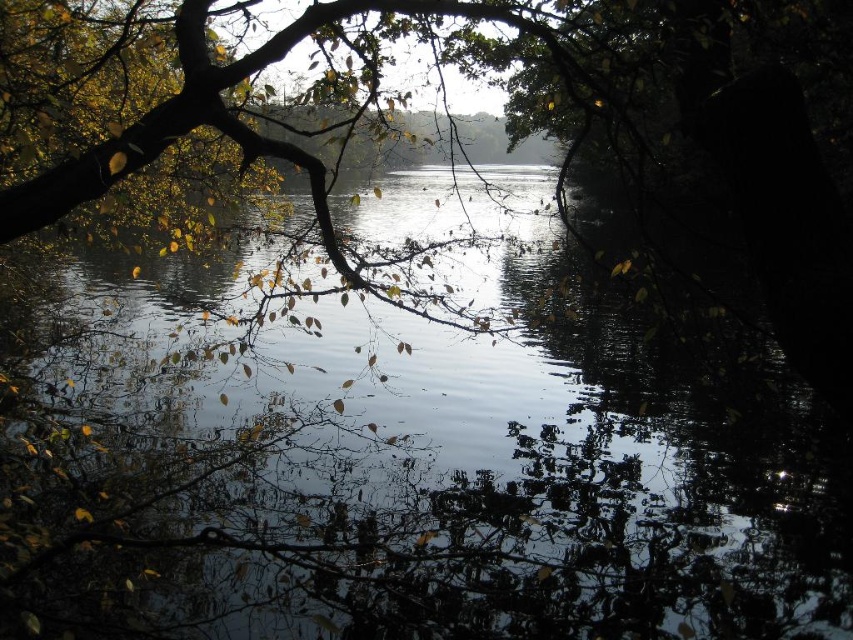
Question: In this image, where is transparent water at center located relative to green matte leaves at upper left?

Choices:
 (A) left
 (B) right

Answer: (B)

Question: Which point is closer to the camera taking this photo?

Choices:
 (A) (160, 150)
 (B) (585, 493)

Answer: (A)

Question: Which point appears closest to the camera in this image?

Choices:
 (A) (282, 419)
 (B) (120, 131)

Answer: (B)

Question: Is transparent water at center to the left of green matte leaves at upper left from the viewer's perspective?

Choices:
 (A) yes
 (B) no

Answer: (B)

Question: Considering the relative positions of transparent water at center and green matte leaves at upper left in the image provided, where is transparent water at center located with respect to green matte leaves at upper left?

Choices:
 (A) below
 (B) above

Answer: (A)

Question: Which object appears closest to the camera in this image?

Choices:
 (A) green matte leaves at upper left
 (B) transparent water at center

Answer: (B)